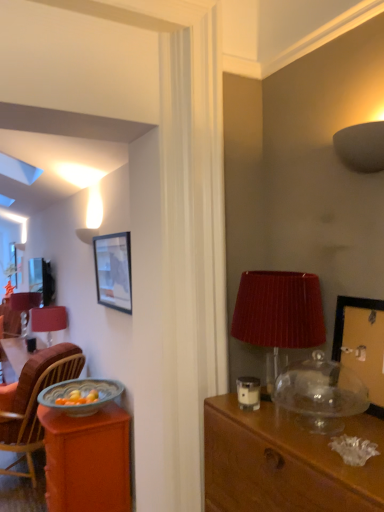
You are a GUI agent. You are given a task and a screenshot of the screen. Output one action in this format:
    pyautogui.click(x=<x>, y=<y>)
    Task: Click on the free space above wooden desk at right, the first desk in the front-to-back sequence (from a real-world perspective)
    
    Given the screenshot: What is the action you would take?
    pyautogui.click(x=304, y=424)